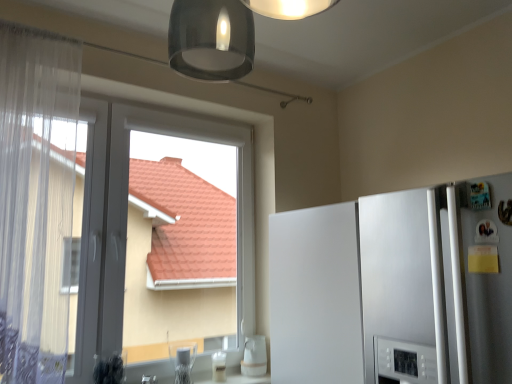
Question: Is transparent plastic window at left wider than white glossy cup at lower center, arranged as the first appliance when viewed from the left?

Choices:
 (A) no
 (B) yes

Answer: (B)

Question: Is transparent plastic window at left positioned beyond the bounds of white glossy cup at lower center, the 2th appliance when ordered from right to left?

Choices:
 (A) no
 (B) yes

Answer: (B)

Question: Does transparent plastic window at left have a greater height compared to white glossy cup at lower center, the 2th appliance when ordered from right to left?

Choices:
 (A) yes
 (B) no

Answer: (A)

Question: Considering the relative positions of transparent plastic window at left and white glossy cup at lower center, the 2th appliance when ordered from right to left, in the image provided, is transparent plastic window at left to the right of white glossy cup at lower center, the 2th appliance when ordered from right to left, from the viewer's perspective?

Choices:
 (A) no
 (B) yes

Answer: (A)

Question: Is transparent plastic window at left far away from white glossy cup at lower center, the 2th appliance when ordered from right to left?

Choices:
 (A) yes
 (B) no

Answer: (B)

Question: From a real-world perspective, relative to clear glass at lower center, acting as the 1th appliance starting from the right, is white glossy cup at lower center, arranged as the first appliance when viewed from the left, vertically above or below?

Choices:
 (A) below
 (B) above

Answer: (B)

Question: From the image's perspective, is white glossy cup at lower center, the 2th appliance when ordered from right to left, above or below clear glass at lower center, acting as the 1th appliance starting from the right?

Choices:
 (A) above
 (B) below

Answer: (A)

Question: Is white glossy cup at lower center, arranged as the first appliance when viewed from the left, inside or outside of clear glass at lower center, acting as the 1th appliance starting from the right?

Choices:
 (A) outside
 (B) inside

Answer: (A)

Question: Considering the positions of white glossy cup at lower center, arranged as the first appliance when viewed from the left, and clear glass at lower center, acting as the 1th appliance starting from the right, in the image, is white glossy cup at lower center, arranged as the first appliance when viewed from the left, bigger or smaller than clear glass at lower center, acting as the 1th appliance starting from the right,?

Choices:
 (A) small
 (B) big

Answer: (B)

Question: In terms of size, does transparent plastic window at left appear bigger or smaller than clear glass at lower center, acting as the 1th appliance starting from the right?

Choices:
 (A) big
 (B) small

Answer: (A)

Question: From a real-world perspective, relative to clear glass at lower center, acting as the 1th appliance starting from the right, is transparent plastic window at left vertically above or below?

Choices:
 (A) below
 (B) above

Answer: (B)

Question: Does point (87, 372) appear closer or farther from the camera than point (221, 370)?

Choices:
 (A) closer
 (B) farther

Answer: (A)

Question: Considering the positions of transparent plastic window at left and clear glass at lower center, which is counted as the 2th appliance, starting from the left, in the image, is transparent plastic window at left taller or shorter than clear glass at lower center, which is counted as the 2th appliance, starting from the left,?

Choices:
 (A) short
 (B) tall

Answer: (B)

Question: Considering their positions, is clear glass at lower center, which is counted as the 2th appliance, starting from the left, located in front of or behind white glossy cup at lower center, arranged as the first appliance when viewed from the left?

Choices:
 (A) behind
 (B) front

Answer: (A)

Question: Looking at the image, does clear glass at lower center, acting as the 1th appliance starting from the right, seem bigger or smaller compared to white glossy cup at lower center, the 2th appliance when ordered from right to left?

Choices:
 (A) big
 (B) small

Answer: (B)